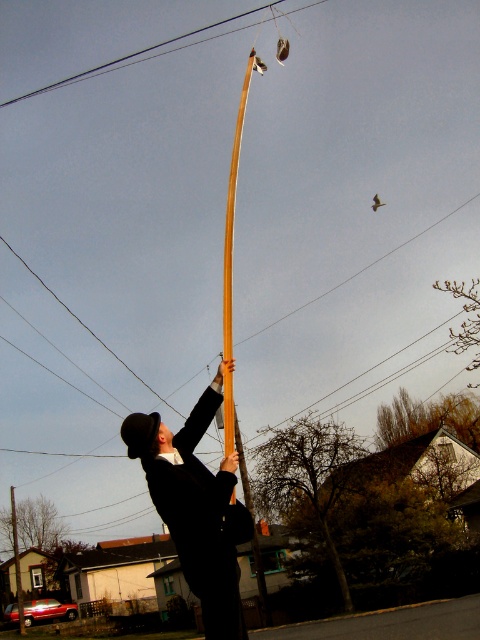
You are a photographer trying to capture the person in the matte black coat at center. Where should you position your camera to ensure the coat is in the frame?

The matte black coat at center is located at point [196,508], so position the camera to focus on that coordinate to include the coat in the frame.

You are a painter standing in the scene and want to hang a canvas between the wooden pole at upper center and the metallic wire at upper center. Which object should you attach the left side of the canvas to so it hangs properly?

The wooden pole at upper center is positioned on the right side of metallic wire at upper center. To hang the canvas properly, attach the left side to the metallic wire at upper center and the right side to the wooden pole at upper center.